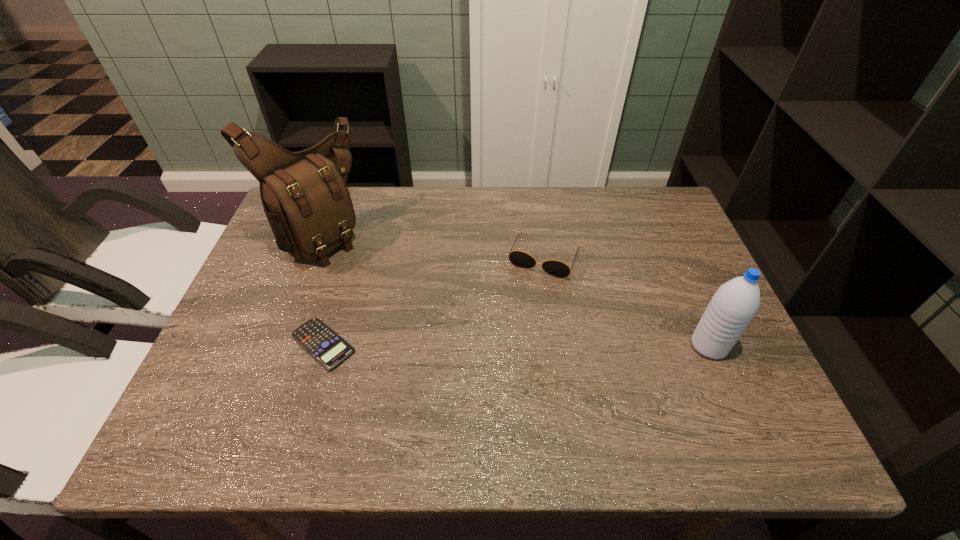
You are a GUI agent. You are given a task and a screenshot of the screen. Output one action in this format:
    pyautogui.click(x=<x>, y=<y>)
    Task: Click on the object situated at the far left corner
    This screenshot has width=960, height=540.
    Given the screenshot: What is the action you would take?
    pyautogui.click(x=304, y=196)

The width and height of the screenshot is (960, 540). In order to click on object situated at the near left corner in this screenshot , I will do `click(329, 349)`.

Find the location of `vacant space at the far edge`. vacant space at the far edge is located at coordinates tap(492, 234).

I want to click on vacant area at the near edge, so click(330, 404).

At what (x,y) coordinates should I click in order to perform the action: click on blank space at the left edge. Please return your answer as a coordinate pair (x, y). Image resolution: width=960 pixels, height=540 pixels. Looking at the image, I should click on (243, 363).

I want to click on vacant space at the right edge, so click(703, 357).

I want to click on free space at the far right corner of the desktop, so click(664, 219).

Locate an element on the screen. The width and height of the screenshot is (960, 540). vacant area that lies between the calculator and the water bottle is located at coordinates point(516,345).

Where is `free space between the tallest object and the calculator`? The height and width of the screenshot is (540, 960). free space between the tallest object and the calculator is located at coordinates (322, 289).

Identify the location of empty location between the second shortest object and the calculator. The image size is (960, 540). (434, 300).